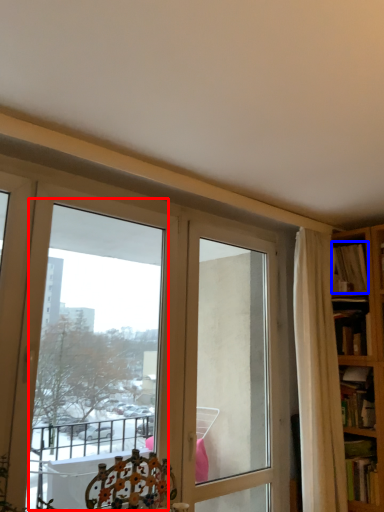
Question: Which of the following is the closest to the observer, bay window (highlighted by a red box) or book (highlighted by a blue box)?

Choices:
 (A) bay window
 (B) book

Answer: (A)